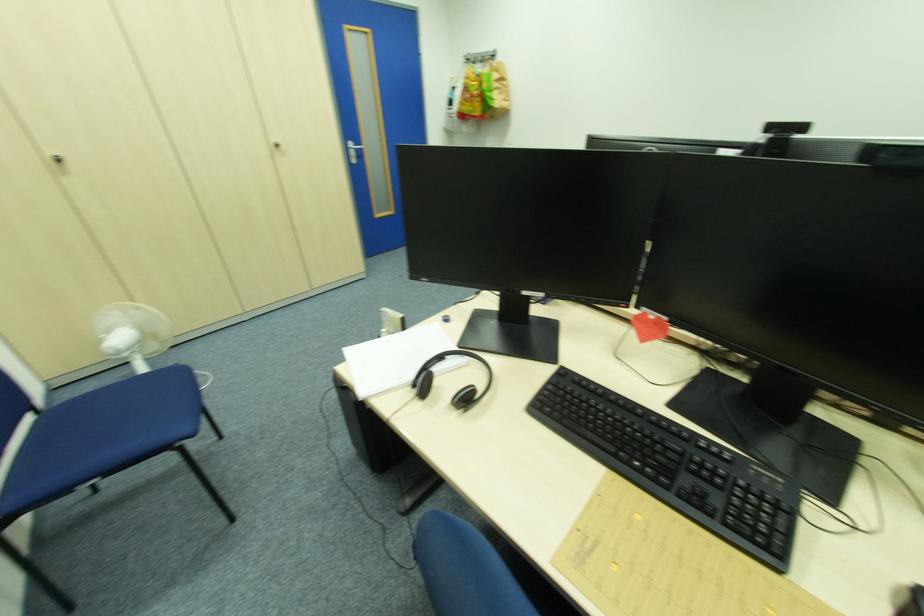
The width and height of the screenshot is (924, 616). What do you see at coordinates (354, 146) in the screenshot? I see `the silver door handle` at bounding box center [354, 146].